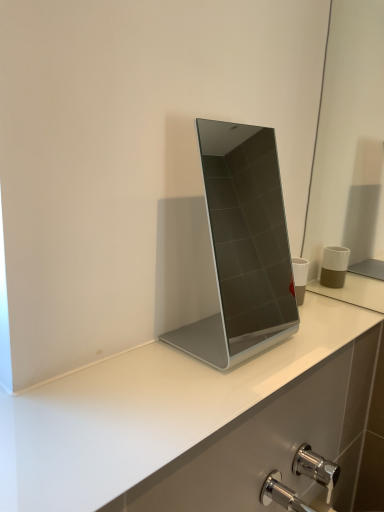
The height and width of the screenshot is (512, 384). What do you see at coordinates (316, 468) in the screenshot?
I see `chrome metallic tap at lower right` at bounding box center [316, 468].

Image resolution: width=384 pixels, height=512 pixels. I want to click on chrome metallic tap at lower right, so click(316, 468).

Measure the distance between point [329,464] and camera.

Point [329,464] and camera are 36.42 inches apart from each other.

This screenshot has height=512, width=384. Describe the element at coordinates (243, 247) in the screenshot. I see `sleek silver laptop at center` at that location.

Image resolution: width=384 pixels, height=512 pixels. I want to click on sleek silver laptop at center, so click(x=243, y=247).

What is the approximate width of sleek silver laptop at center?

6.83 inches.

In order to click on chrome metallic tap at lower right in this screenshot , I will do `click(316, 468)`.

From the picture: Is sleek silver laptop at center to the left of chrome metallic tap at lower right from the viewer's perspective?

Correct, you'll find sleek silver laptop at center to the left of chrome metallic tap at lower right.

Is sleek silver laptop at center further to camera compared to chrome metallic tap at lower right?

No, it is in front of chrome metallic tap at lower right.

Which is in front, point (215, 255) or point (294, 471)?

The point (294, 471) is closer to the camera.

From the image's perspective, does sleek silver laptop at center appear lower than chrome metallic tap at lower right?

Actually, sleek silver laptop at center appears above chrome metallic tap at lower right in the image.

From a real-world perspective, is sleek silver laptop at center positioned over chrome metallic tap at lower right based on gravity?

Yes, from a real-world perspective, sleek silver laptop at center is on top of chrome metallic tap at lower right.

Considering the sizes of sleek silver laptop at center and chrome metallic tap at lower right in the image, is sleek silver laptop at center wider or thinner than chrome metallic tap at lower right?

Considering their sizes, sleek silver laptop at center looks broader than chrome metallic tap at lower right.

Which of these two, sleek silver laptop at center or chrome metallic tap at lower right, stands shorter?

chrome metallic tap at lower right is shorter.

Does sleek silver laptop at center have a smaller size compared to chrome metallic tap at lower right?

Incorrect, sleek silver laptop at center is not smaller in size than chrome metallic tap at lower right.

Is sleek silver laptop at center situated inside chrome metallic tap at lower right or outside?

sleek silver laptop at center is not enclosed by chrome metallic tap at lower right.

Would you consider sleek silver laptop at center to be distant from chrome metallic tap at lower right?

Yes, sleek silver laptop at center is far from chrome metallic tap at lower right.

Is sleek silver laptop at center oriented away from chrome metallic tap at lower right?

That's not correct — sleek silver laptop at center is not looking away from chrome metallic tap at lower right.

Measure the distance between sleek silver laptop at center and chrome metallic tap at lower right.

8.55 feet.

Where is `laptop in front of the chrome metallic tap at lower right`? laptop in front of the chrome metallic tap at lower right is located at coordinates (243, 247).

Considering the positions of objects chrome metallic tap at lower right and sleek silver laptop at center in the image provided, who is more to the left, chrome metallic tap at lower right or sleek silver laptop at center?

From the viewer's perspective, sleek silver laptop at center appears more on the left side.

In the image, is chrome metallic tap at lower right positioned in front of or behind sleek silver laptop at center?

Clearly, chrome metallic tap at lower right is behind sleek silver laptop at center.

Is point (312, 452) closer to viewer compared to point (173, 334)?

No.

From the image's perspective, which one is positioned lower, chrome metallic tap at lower right or sleek silver laptop at center?

chrome metallic tap at lower right is shown below in the image.

From a real-world perspective, is chrome metallic tap at lower right on sleek silver laptop at center?

No.

Is chrome metallic tap at lower right thinner than sleek silver laptop at center?

Yes.

Is chrome metallic tap at lower right taller than sleek silver laptop at center?

In fact, chrome metallic tap at lower right may be shorter than sleek silver laptop at center.

Between chrome metallic tap at lower right and sleek silver laptop at center, which one has smaller size?

With smaller size is chrome metallic tap at lower right.

Do you think chrome metallic tap at lower right is within sleek silver laptop at center, or outside of it?

chrome metallic tap at lower right is located beyond the bounds of sleek silver laptop at center.

Are chrome metallic tap at lower right and sleek silver laptop at center located far from each other?

Indeed, chrome metallic tap at lower right is not near sleek silver laptop at center.

Is chrome metallic tap at lower right oriented away from sleek silver laptop at center?

chrome metallic tap at lower right does not have its back to sleek silver laptop at center.

What are the coordinates of `tap on the right of sleek silver laptop at center` in the screenshot? It's located at (316, 468).

Find the location of `laptop on the left of chrome metallic tap at lower right`. laptop on the left of chrome metallic tap at lower right is located at coordinates (243, 247).

Image resolution: width=384 pixels, height=512 pixels. In order to click on tap to the right of sleek silver laptop at center in this screenshot , I will do `click(316, 468)`.